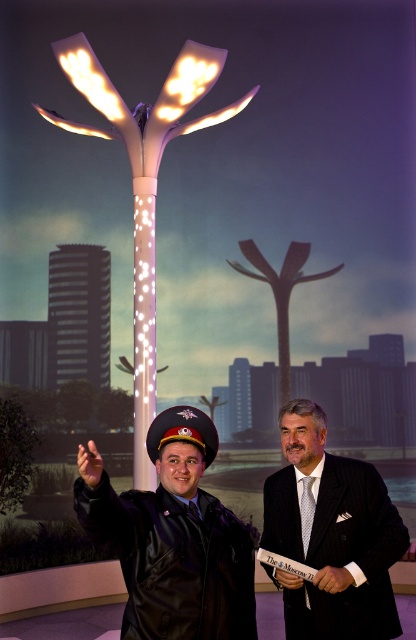
Does transparent glass pole at center appear on the right side of shiny black uniform at center?

Indeed, transparent glass pole at center is positioned on the right side of shiny black uniform at center.

Which is above, transparent glass pole at center or shiny black uniform at center?

transparent glass pole at center

What do you see at coordinates (222, 172) in the screenshot? I see `transparent glass pole at center` at bounding box center [222, 172].

The image size is (416, 640). In order to click on transparent glass pole at center in this screenshot , I will do `click(222, 172)`.

Is point (346, 572) farther from viewer compared to point (287, 586)?

No, it is in front of (287, 586).

Is smooth leather hand at lower center thinner than matte black hand at lower center?

Result: Incorrect, smooth leather hand at lower center's width is not less than matte black hand at lower center's.

Is point (319, 579) positioned in front of point (284, 579)?

Yes, point (319, 579) is closer to viewer.

Find the location of a particular element. Image resolution: width=416 pixels, height=640 pixels. smooth leather hand at lower center is located at coordinates (332, 579).

Between point (341, 483) and point (344, 579), which one is positioned in front?

Positioned in front is point (344, 579).

Can you confirm if shiny black uniform at center is taller than smooth leather hand at lower center?

Yes, shiny black uniform at center is taller than smooth leather hand at lower center.

Is point (182, 474) positioned behind point (336, 582)?

No.

Where is `shiny black uniform at center`? The image size is (416, 640). shiny black uniform at center is located at coordinates [175, 540].